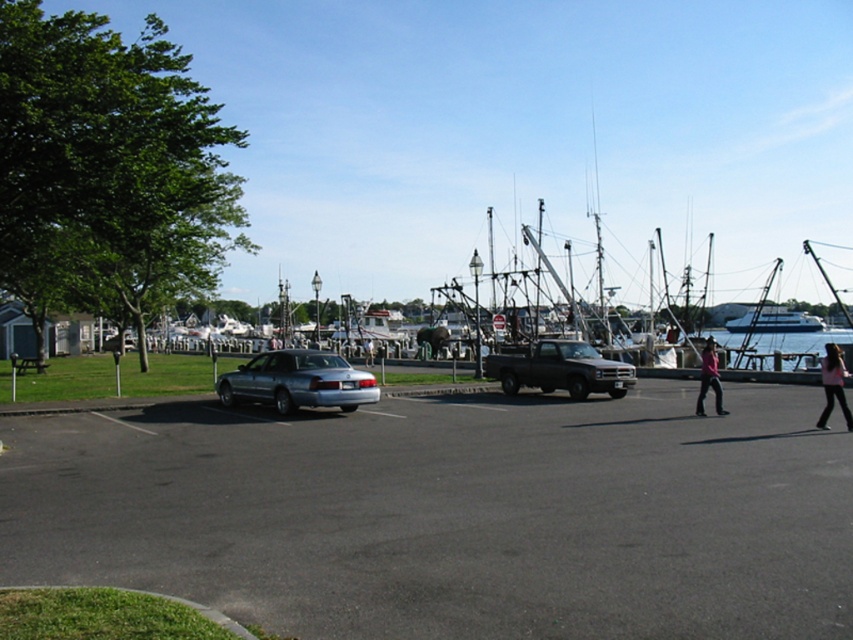
You are a delivery person trying to park your van in the parking lot. You see the satin silver sedan at center and the pink fabric pants at right. Can you determine which one takes up more space in the parking lot?

The pink fabric pants at right takes up more space in the parking lot than the satin silver sedan at center because the satin silver sedan at center occupies less space than pink fabric pants at right.

You are standing in the parking lot and want to walk from the satin silver sedan at center to the pink fabric pants at right. Which direction should you move relative to the sedan?

You should move towards the right side of the satin silver sedan at center to reach the pink fabric pants at right since the sedan is closer to you than the pants.